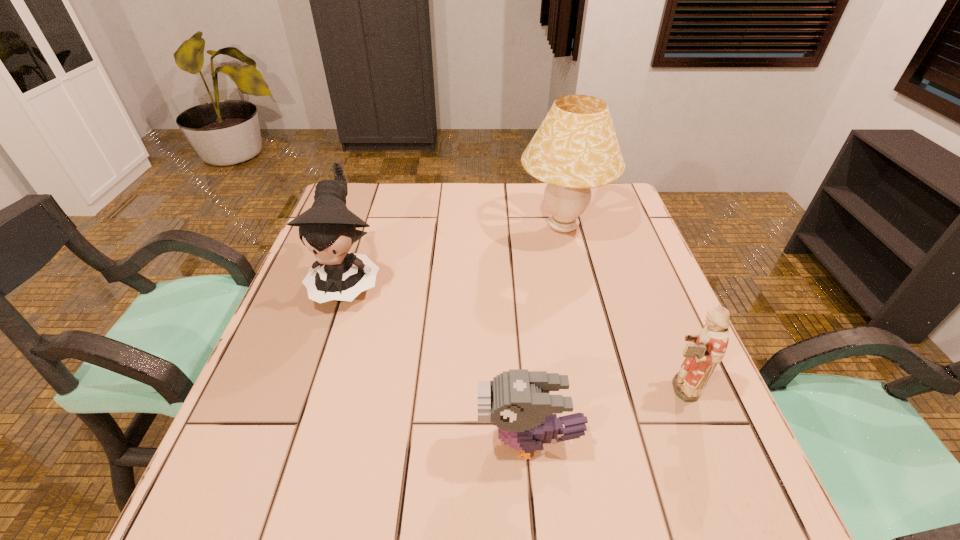
Find the location of a particular element. The width and height of the screenshot is (960, 540). vacant point located between the shortest object and the third farthest object is located at coordinates (604, 414).

Find the location of `free area in between the bird and the figurine`. free area in between the bird and the figurine is located at coordinates (604, 414).

The width and height of the screenshot is (960, 540). What are the coordinates of `vacant point located between the second shortest object and the tallest object` in the screenshot? It's located at (620, 307).

Identify the location of the third closest object to the tallest object. (518, 402).

Where is `the second closest object to the third shortest object`? This screenshot has width=960, height=540. the second closest object to the third shortest object is located at coordinates (518, 402).

This screenshot has height=540, width=960. In order to click on free region that satisfies the following two spatial constraints: 1. on the front side of the lampshade; 2. at the beak of the bird in this screenshot , I will do `click(613, 441)`.

You are a GUI agent. You are given a task and a screenshot of the screen. Output one action in this format:
    pyautogui.click(x=<x>, y=<y>)
    Task: Click on the vacant region that satisfies the following two spatial constraints: 1. on the front side of the lampshade; 2. at the beak of the bird
    
    Given the screenshot: What is the action you would take?
    pyautogui.click(x=613, y=441)